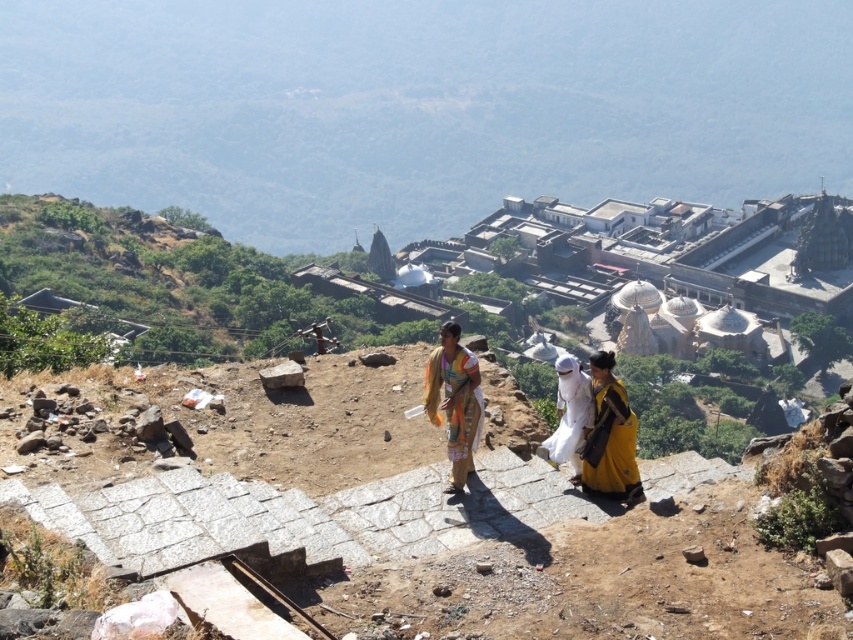
You are standing at the point labeled point (445, 336) and want to reach the entrance of the temple complex. The entrance is located at the other end of the stone staircase. If you walk straight towards the entrance, will you have to climb or descend the staircase?

Since the stone staircase leads down towards the complex and you are at point 0.523, you would need to descend the staircase to reach the entrance.

You are a photographer standing at the top of the stone staircase overlooking the temple complex. You notice two people wearing different dresses. The yellow fabric dress at lower right and the white cotton dress at center. Which dress is shorter?

The yellow fabric dress at lower right is shorter than the white cotton dress at center.

You are a photographer planning to capture a symmetrical composition of the multicolored fabric at center and the white cotton dress at center. Based on their positions, which one should be placed on the left side of the frame to maintain symmetry?

The multicolored fabric at center should be placed on the left side of the frame because it is already positioned on the left side of the white cotton dress at center in the image.